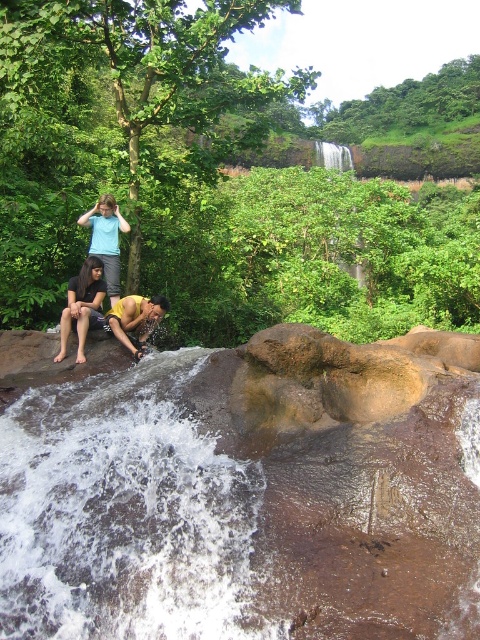
You are standing at the edge of the waterfall and want to take a photo of both the matte blue shirt at center and the matte blue shirt at upper left. Which one will be closer to the camera in the photo?

The matte blue shirt at center will be closer to the camera because it is in front of the matte blue shirt at upper left.

From the picture: You are a photographer trying to capture the scene of the dark brown hair at lower left and the matte blue shirt at upper left. Which object should you zoom in on to make them appear the same size in the photo?

Since the dark brown hair at lower left is smaller than the matte blue shirt at upper left, you should zoom in on the dark brown hair at lower left to make them appear the same size in the photo.

You are standing at the edge of the waterfall and want to hand a water bottle to both the dark brown hair at lower left and the matte blue shirt at upper left. Which person should you give the bottle to first to ensure you don

You should give the water bottle to the dark brown hair at lower left first because it is closer to you than the matte blue shirt at upper left.